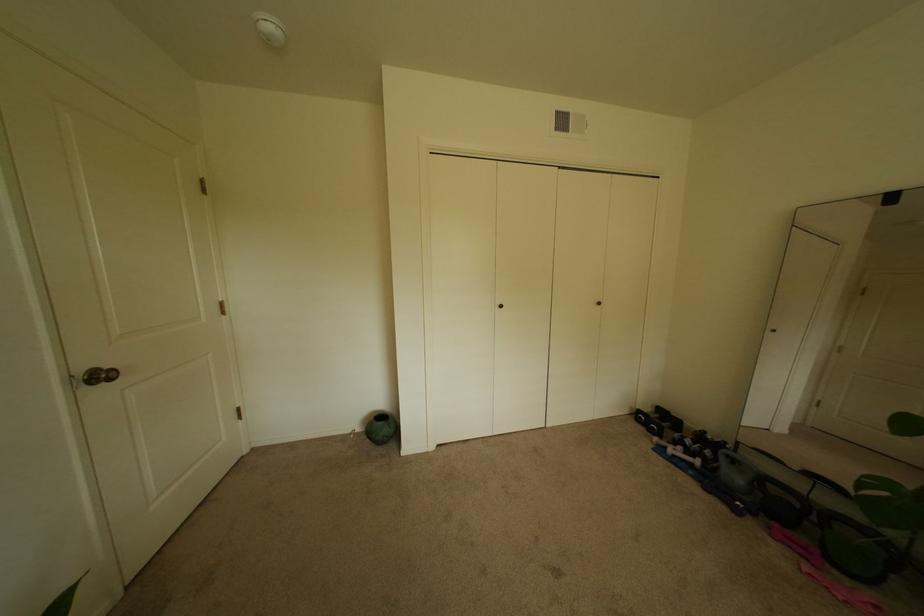
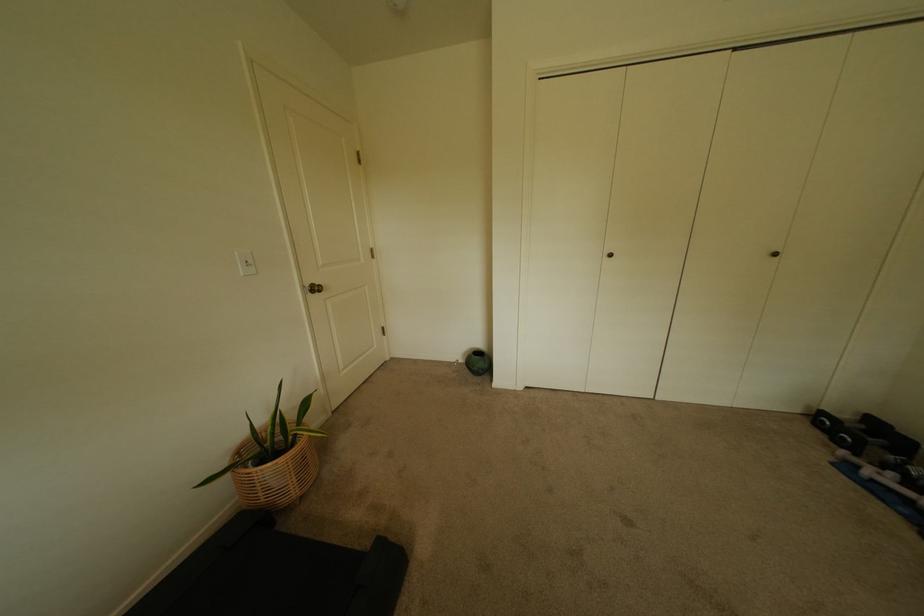
Locate, in the second image, the point that corresponds to (x=377, y=442) in the first image.

(476, 371)